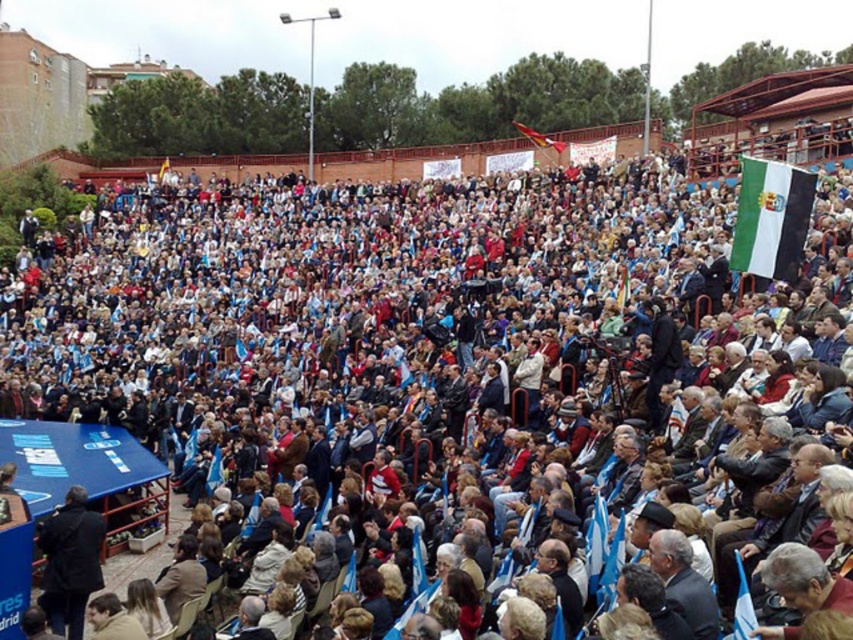
Question: Does white and black fabric flag at upper right appear on the left side of white fabric flag at center?

Choices:
 (A) no
 (B) yes

Answer: (A)

Question: In this image, where is white and black fabric flag at upper right located relative to white fabric flag at center?

Choices:
 (A) left
 (B) right

Answer: (B)

Question: Is white and black fabric flag at upper right positioned at the back of white fabric flag at center?

Choices:
 (A) yes
 (B) no

Answer: (B)